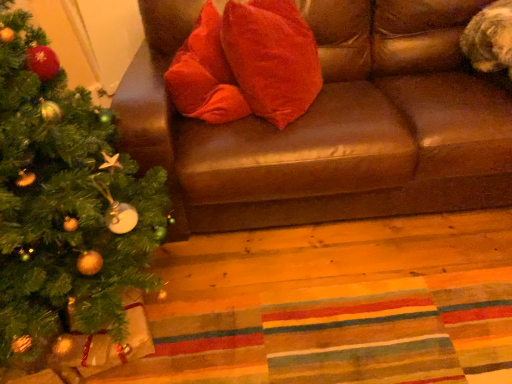
What are the coordinates of `brown leather couch at upper center` in the screenshot? It's located at (331, 124).

Locate an element on the screen. The height and width of the screenshot is (384, 512). brown leather couch at upper center is located at coordinates (331, 124).

Is brown leather couch at upper center positioned in front of green matte christmas tree at left?

No, it is behind green matte christmas tree at left.

Between brown leather couch at upper center and green matte christmas tree at left, which one has smaller width?

green matte christmas tree at left.

Is point (462, 125) closer or farther from the camera than point (19, 87)?

Point (462, 125).

Is point (273, 89) positioned before point (346, 200)?

That is True.

Is velvet red pillow at center positioned far away from brown leather couch at upper center?

velvet red pillow at center is actually quite close to brown leather couch at upper center.

Is velvet red pillow at center bigger than brown leather couch at upper center?

Actually, velvet red pillow at center might be smaller than brown leather couch at upper center.

The height and width of the screenshot is (384, 512). Identify the location of throw pillow that appears above the brown leather couch at upper center (from the image's perspective). (272, 58).

From the image's perspective, which one is positioned higher, brown leather couch at upper center or velvet red pillow at center?

velvet red pillow at center appears higher in the image.

Between brown leather couch at upper center and velvet red pillow at center, which one has larger size?

brown leather couch at upper center is bigger.

Considering the positions of point (214, 181) and point (278, 89), is point (214, 181) closer or farther from the camera than point (278, 89)?

Point (214, 181) is positioned closer to the camera compared to point (278, 89).

Is brown leather couch at upper center inside or outside of velvet red pillow at center?

brown leather couch at upper center lies outside velvet red pillow at center.

Is velvet red pillow at center inside the boundaries of green matte christmas tree at left, or outside?

velvet red pillow at center is not enclosed by green matte christmas tree at left.

Is velvet red pillow at center to the right of green matte christmas tree at left from the viewer's perspective?

Indeed, velvet red pillow at center is positioned on the right side of green matte christmas tree at left.

In the scene shown: From a real-world perspective, who is located lower, velvet red pillow at center or green matte christmas tree at left?

From a 3D spatial view, green matte christmas tree at left is below.

Is velvet red pillow at center aimed at green matte christmas tree at left?

No, velvet red pillow at center is not aimed at green matte christmas tree at left.

Identify the location of throw pillow on the right of green matte christmas tree at left. (272, 58).

Is green matte christmas tree at left facing away from velvet red pillow at center?

No.

From a real-world perspective, relative to velvet red pillow at center, is green matte christmas tree at left vertically above or below?

green matte christmas tree at left is situated lower than velvet red pillow at center in the real world.

Considering the sizes of objects green matte christmas tree at left and velvet red pillow at center in the image provided, who is thinner, green matte christmas tree at left or velvet red pillow at center?

velvet red pillow at center is thinner.

From a real-world perspective, is green matte christmas tree at left physically below brown leather couch at upper center?

No, from a real-world perspective, green matte christmas tree at left is not beneath brown leather couch at upper center.

Which object is further away from the camera, green matte christmas tree at left or brown leather couch at upper center?

brown leather couch at upper center.

Can brown leather couch at upper center be found inside green matte christmas tree at left?

No, green matte christmas tree at left does not contain brown leather couch at upper center.

Can you tell me how much green matte christmas tree at left and brown leather couch at upper center differ in facing direction?

The angular difference between green matte christmas tree at left and brown leather couch at upper center is 0.268 degrees.

The image size is (512, 384). Identify the location of christmas tree in front of the brown leather couch at upper center. (62, 204).

Find the location of `studio couch that is below the velvet red pillow at center (from the image's perspective)`. studio couch that is below the velvet red pillow at center (from the image's perspective) is located at coordinates pyautogui.click(x=331, y=124).

When comparing their distances from green matte christmas tree at left, does velvet red pillow at center or brown leather couch at upper center seem closer?

Among the two, brown leather couch at upper center is located nearer to green matte christmas tree at left.

From the picture: When comparing their distances from velvet red pillow at center, does brown leather couch at upper center or green matte christmas tree at left seem closer?

brown leather couch at upper center is positioned closer to the anchor velvet red pillow at center.

Estimate the real-world distances between objects in this image. Which object is further from velvet red pillow at center, green matte christmas tree at left or brown leather couch at upper center?

green matte christmas tree at left.

Which object lies further to the anchor point green matte christmas tree at left, brown leather couch at upper center or velvet red pillow at center?

Based on the image, velvet red pillow at center appears to be further to green matte christmas tree at left.

Based on their spatial positions, is green matte christmas tree at left or velvet red pillow at center closer to brown leather couch at upper center?

velvet red pillow at center is closer to brown leather couch at upper center.

Which object lies nearer to the anchor point brown leather couch at upper center, velvet red pillow at center or green matte christmas tree at left?

velvet red pillow at center is positioned closer to the anchor brown leather couch at upper center.

Identify the location of throw pillow located between green matte christmas tree at left and brown leather couch at upper center in the left-right direction. (272, 58).